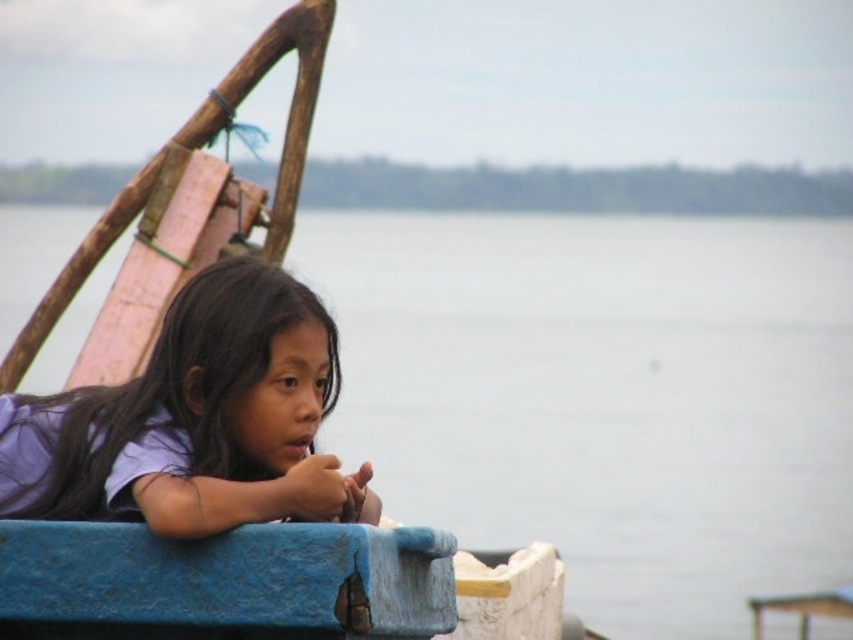
You are standing on the boat and want to place a small item on the nearest point between point (653, 388) and point (207, 438). Which point should you choose?

Point (653, 388) is closer to you than point (207, 438), so you should place the item on point (653, 388).

Based on the scene, which object occupies a larger area in the image? Please choose between the gray water at center and the purple matte shirt at center.

The gray water at center is bigger than the purple matte shirt at center, so the gray water at center occupies a larger area in the image.

You are standing on the boat and want to look at the gray water at center and the purple matte shirt at center. Which object is positioned more to the left?

The gray water at center is to the left of the purple matte shirt at center.